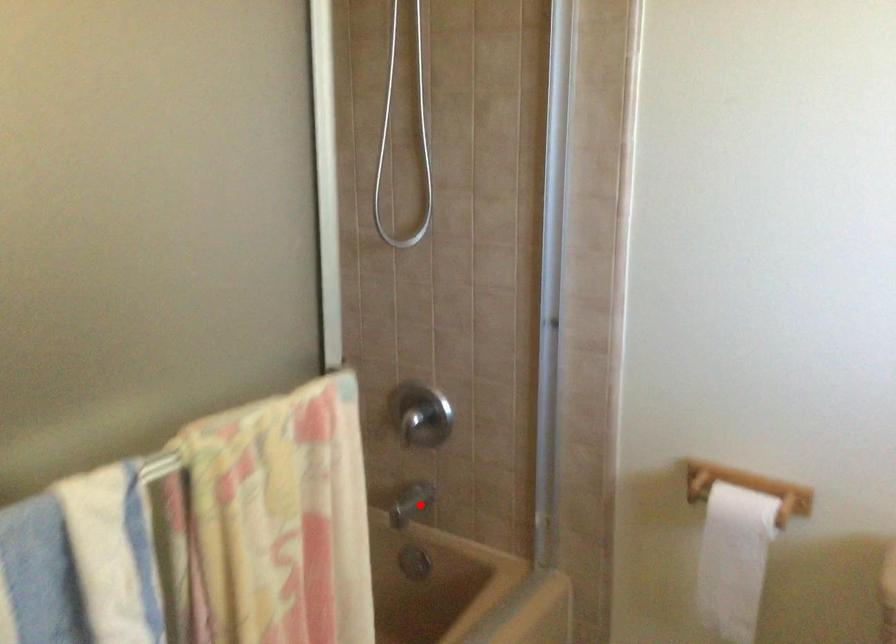
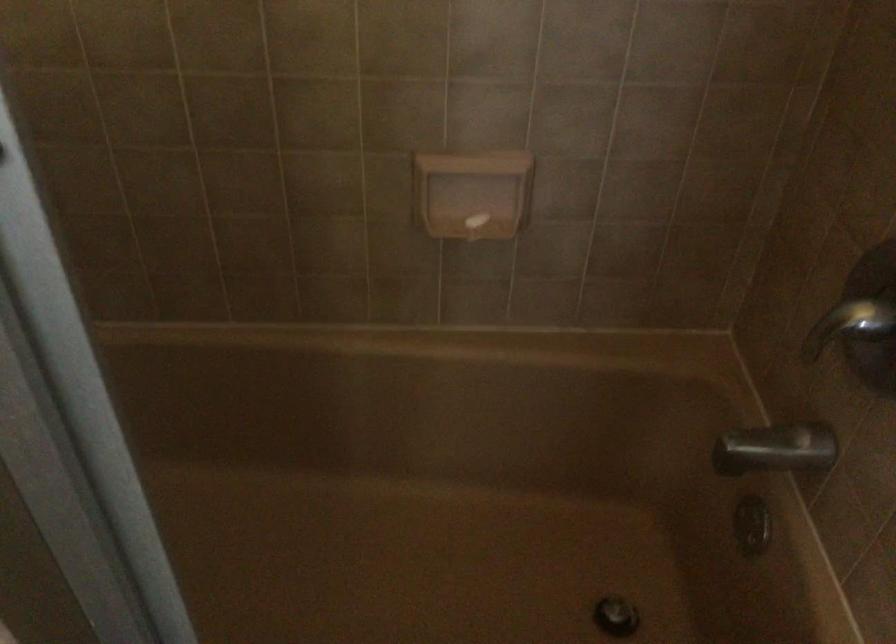
Question: I am providing you with two images of the same scene from different viewpoints. Image1 has a red point marked. In image2, the corresponding 3D location appears at what relative position? Reply with the corresponding letter.

Choices:
 (A) Closer
 (B) Farther

Answer: (A)